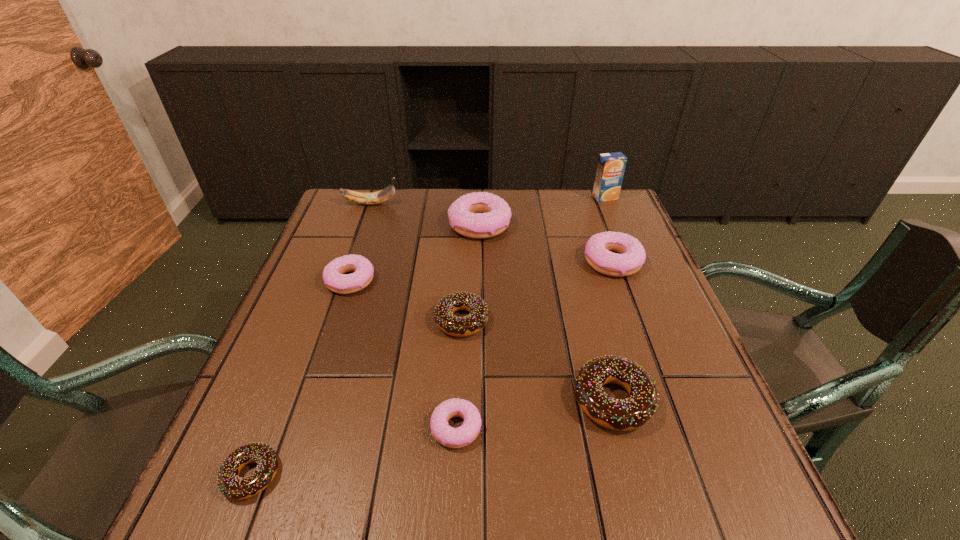
Identify the location of the fourth nearest doughnut. The width and height of the screenshot is (960, 540). (455, 326).

Find the location of a particular element. The height and width of the screenshot is (540, 960). the second biggest chocolate doughnut is located at coordinates pos(455,326).

The image size is (960, 540). What are the coordinates of `the smallest purple doughnut` in the screenshot? It's located at (461, 436).

I want to click on the smallest chocolate doughnut, so click(232, 486).

The image size is (960, 540). Identify the location of the leftmost chocolate doughnut. (232, 486).

Locate an element on the screen. This screenshot has height=540, width=960. free space located 0.060m on the front of the orange_juice is located at coordinates (612, 213).

Where is `blank space located on the peel of the banana`? Image resolution: width=960 pixels, height=540 pixels. blank space located on the peel of the banana is located at coordinates (481, 204).

At what (x,y) coordinates should I click in order to perform the action: click on free location located on the left of the seventh shortest object. Please return your answer as a coordinate pair (x, y). The height and width of the screenshot is (540, 960). Looking at the image, I should click on (393, 225).

Locate an element on the screen. The height and width of the screenshot is (540, 960). free spot located on the front of the second biggest purple doughnut is located at coordinates point(636,330).

The image size is (960, 540). Find the location of `free space located on the back of the second nearest chocolate doughnut`. free space located on the back of the second nearest chocolate doughnut is located at coordinates (591, 317).